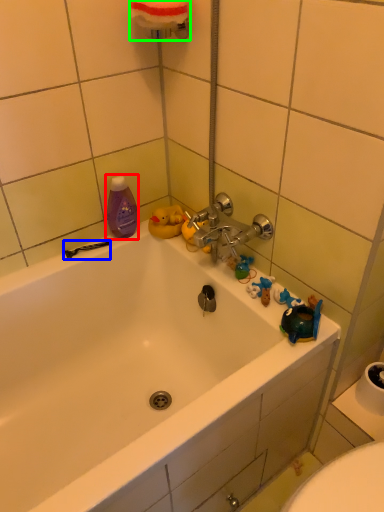
Question: Based on their relative distances, which object is farther from mouthwash (highlighted by a red box)? Choose from shower (highlighted by a blue box) and towel bar (highlighted by a green box).

Choices:
 (A) shower
 (B) towel bar

Answer: (B)